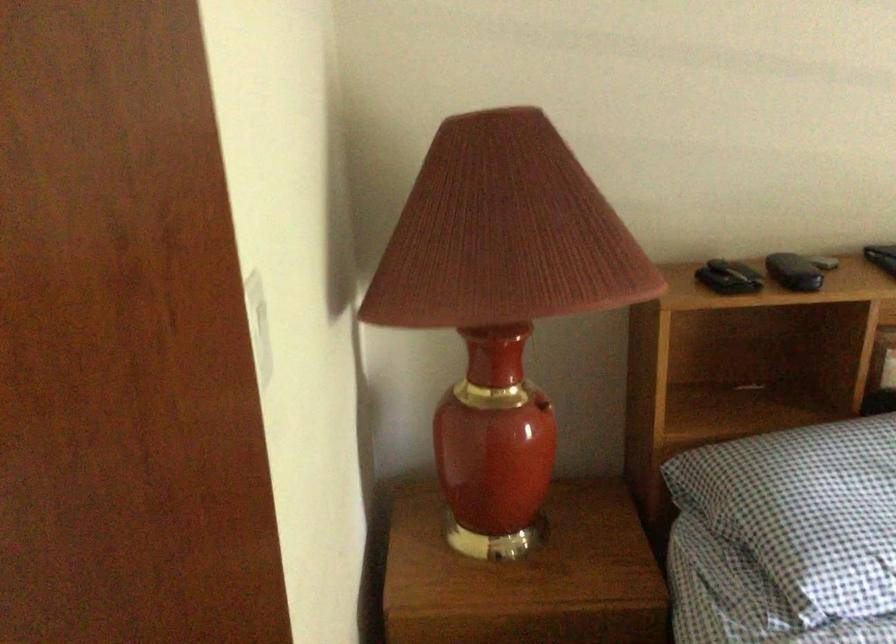
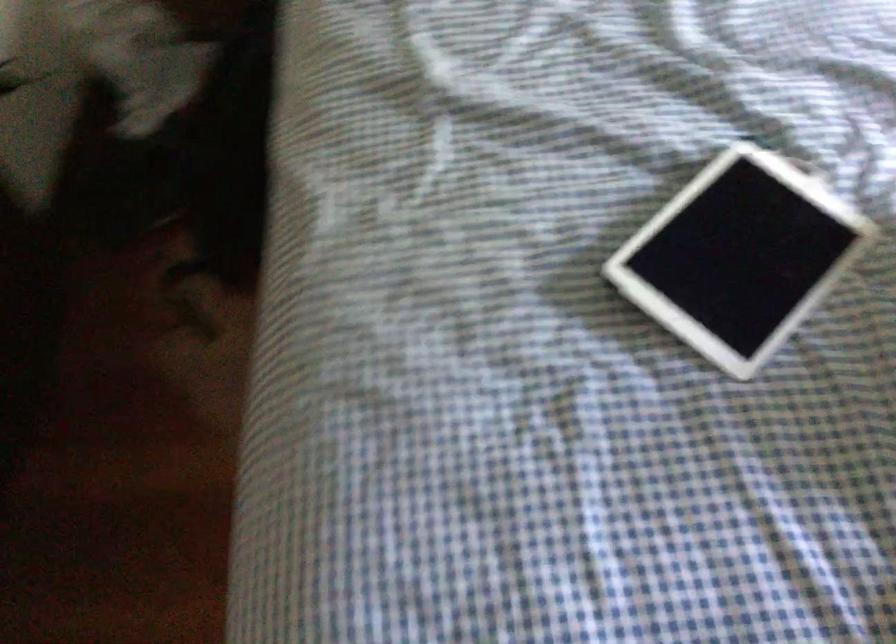
Question: The images are taken continuously from a first-person perspective. In which direction is your viewpoint rotating?

Choices:
 (A) Left
 (B) Right
 (C) Up
 (D) Down

Answer: (D)